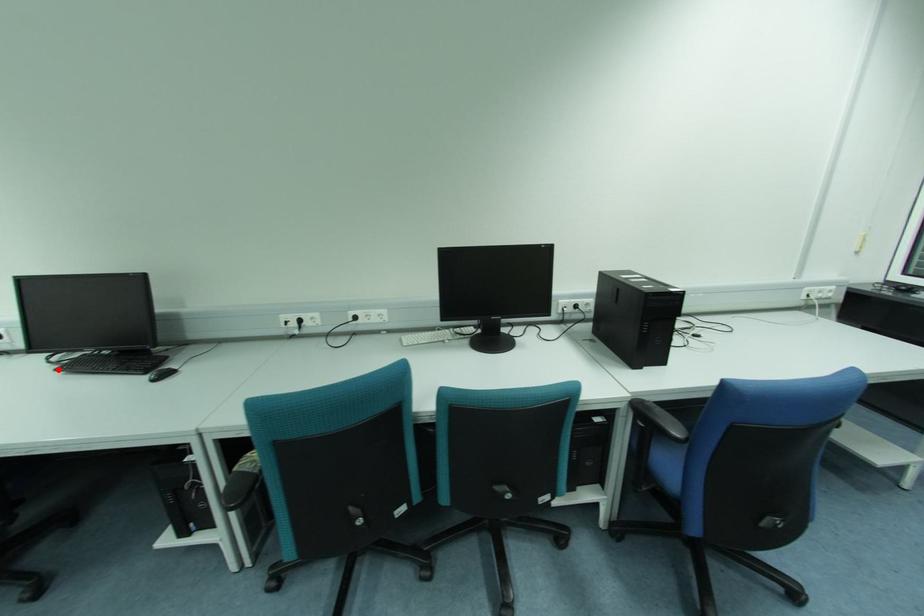
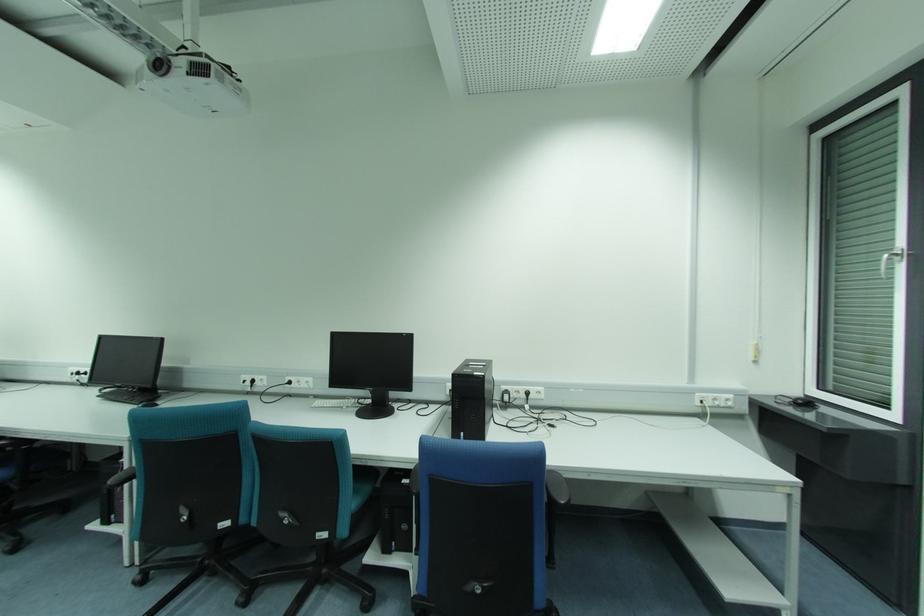
The point at the highlighted location is marked in the first image. Where is the corresponding point in the second image?

(100, 397)